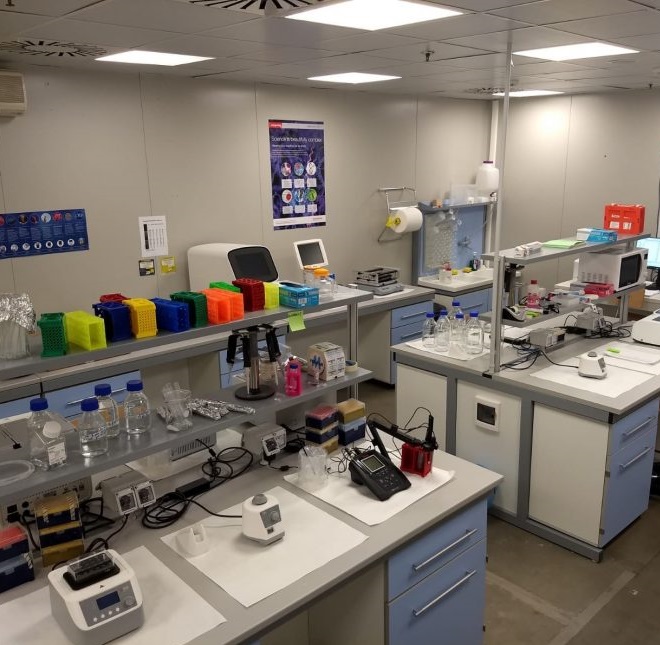
Where is `floor`? floor is located at coordinates [x=542, y=595].